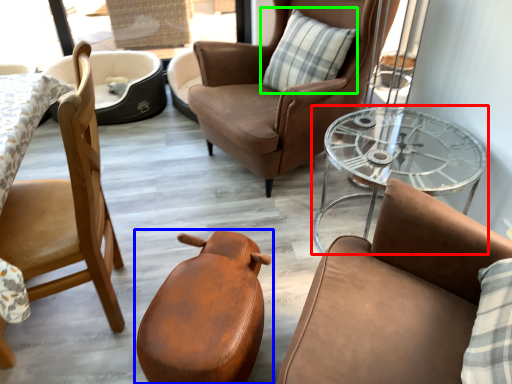
Question: Considering the real-world distances, which object is farthest from table (highlighted by a red box)? chair (highlighted by a blue box) or pillow (highlighted by a green box)?

Choices:
 (A) chair
 (B) pillow

Answer: (A)